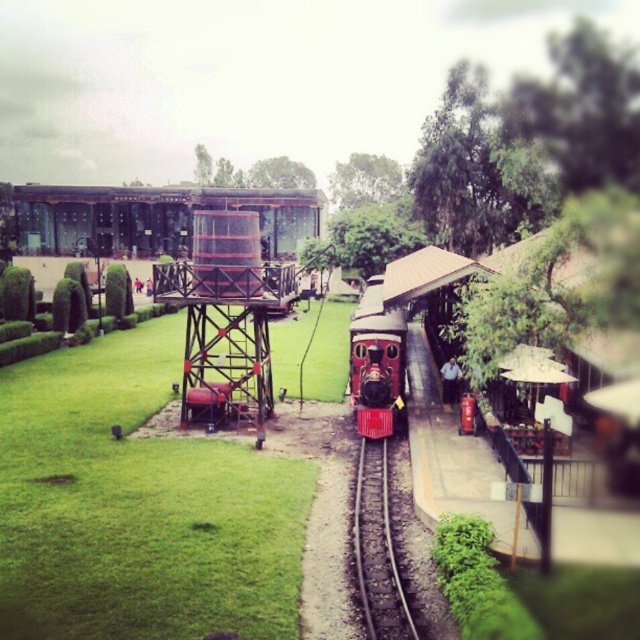
The height and width of the screenshot is (640, 640). What do you see at coordinates (378, 550) in the screenshot?
I see `black metal train track at center` at bounding box center [378, 550].

Which is behind, point (371, 484) or point (369, 353)?

Point (369, 353)

The height and width of the screenshot is (640, 640). What are the coordinates of `black metal train track at center` in the screenshot? It's located at (378, 550).